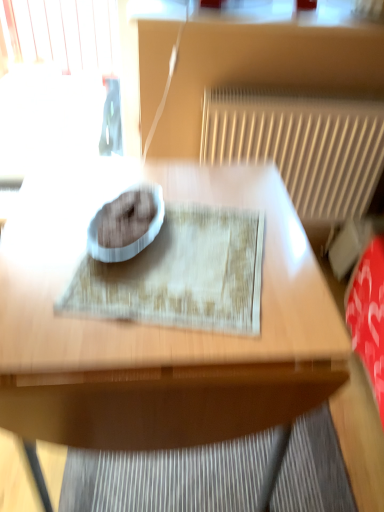
Question: Is wooden table at center outside white textured radiator at upper right?

Choices:
 (A) no
 (B) yes

Answer: (B)

Question: Can you confirm if wooden table at center is wider than white textured radiator at upper right?

Choices:
 (A) no
 (B) yes

Answer: (B)

Question: From a real-world perspective, does wooden table at center stand above white textured radiator at upper right?

Choices:
 (A) yes
 (B) no

Answer: (B)

Question: Does wooden table at center have a lesser height compared to white textured radiator at upper right?

Choices:
 (A) yes
 (B) no

Answer: (B)

Question: Is wooden table at center at the right side of white textured radiator at upper right?

Choices:
 (A) no
 (B) yes

Answer: (A)

Question: Considering the positions of white textured radiator at upper right and wooden table at center in the image, is white textured radiator at upper right wider or thinner than wooden table at center?

Choices:
 (A) thin
 (B) wide

Answer: (A)

Question: Considering their positions, is white textured radiator at upper right located in front of or behind wooden table at center?

Choices:
 (A) behind
 (B) front

Answer: (A)

Question: From a real-world perspective, is white textured radiator at upper right physically located above or below wooden table at center?

Choices:
 (A) below
 (B) above

Answer: (B)

Question: Visually, is white textured radiator at upper right positioned to the left or to the right of wooden table at center?

Choices:
 (A) left
 (B) right

Answer: (B)

Question: Is textured beige mat at center inside or outside of white textured radiator at upper right?

Choices:
 (A) outside
 (B) inside

Answer: (A)

Question: From a real-world perspective, is textured beige mat at center positioned above or below white textured radiator at upper right?

Choices:
 (A) below
 (B) above

Answer: (B)

Question: Is textured beige mat at center wider or thinner than white textured radiator at upper right?

Choices:
 (A) wide
 (B) thin

Answer: (A)

Question: Is textured beige mat at center bigger or smaller than white textured radiator at upper right?

Choices:
 (A) small
 (B) big

Answer: (A)

Question: Does point (39, 234) appear closer or farther from the camera than point (193, 238)?

Choices:
 (A) closer
 (B) farther

Answer: (A)

Question: From a real-world perspective, relative to textured beige mat at center, is wooden table at center vertically above or below?

Choices:
 (A) below
 (B) above

Answer: (A)